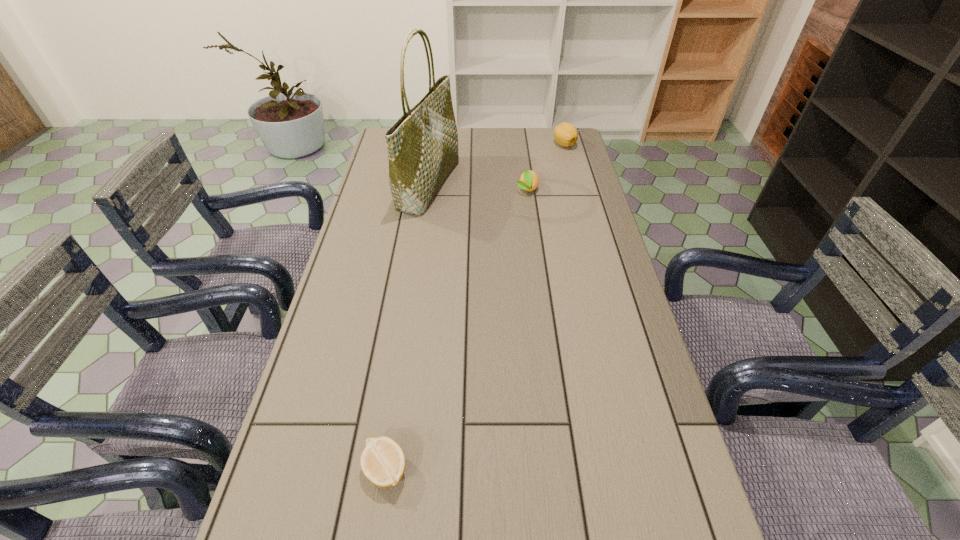
Where is `free area in between the second object from right to left and the shopping bag`? The image size is (960, 540). free area in between the second object from right to left and the shopping bag is located at coordinates (478, 187).

I want to click on free spot between the nearest lemon and the tallest object, so click(x=407, y=327).

Identify the location of vacant space in between the farthest lemon and the shopping bag. The width and height of the screenshot is (960, 540). (496, 165).

Where is `empty space that is in between the leftmost lemon and the rightmost lemon`? empty space that is in between the leftmost lemon and the rightmost lemon is located at coordinates (475, 307).

I want to click on vacant space in between the farthest object and the second farthest lemon, so click(545, 167).

At what (x,y) coordinates should I click in order to perform the action: click on vacant point located between the shopping bag and the second tallest object. Please return your answer as a coordinate pair (x, y). Looking at the image, I should click on (496, 165).

Image resolution: width=960 pixels, height=540 pixels. Find the location of `vacant area that lies between the nearest object and the second nearest lemon`. vacant area that lies between the nearest object and the second nearest lemon is located at coordinates tap(456, 329).

I want to click on free space between the tallest object and the rightmost lemon, so click(496, 165).

The height and width of the screenshot is (540, 960). Find the location of `vacant space that is in between the second shortest object and the shopping bag`. vacant space that is in between the second shortest object and the shopping bag is located at coordinates (478, 187).

The image size is (960, 540). I want to click on vacant point located between the nearest object and the third object from left to right, so click(456, 329).